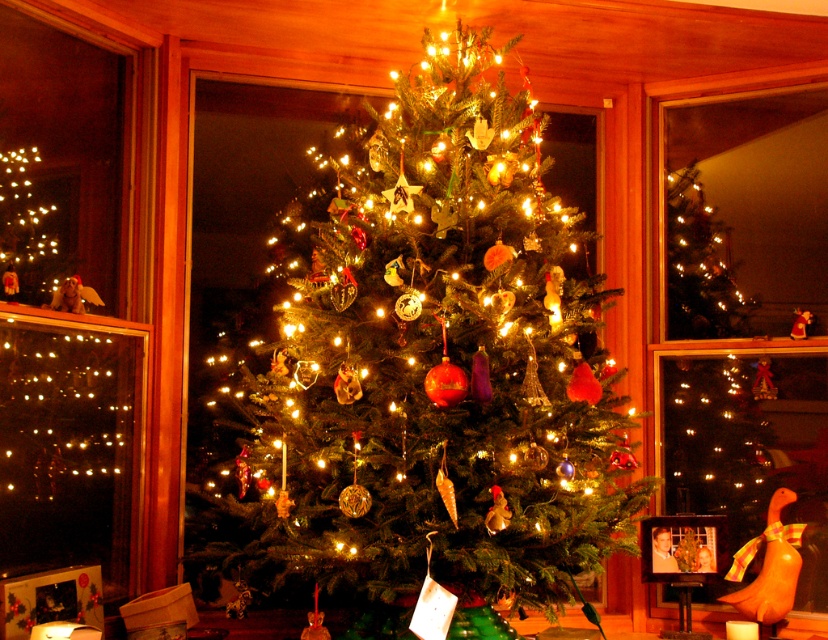
You are standing in the living room and want to take a photo of the green matte christmas tree at center through the clear glass window at upper left. Is the tree positioned in a way that allows you to capture it in the frame?

The green matte christmas tree at center is to the right of the clear glass window at upper left, so you can position yourself to take a photo of the green matte christmas tree at center through the clear glass window at upper left as it is located to the right side of the window.

You are standing in front of the Christmas tree and want to see the view outside through the clear glass window at upper left. Based on its position, where should you look to see the outside view?

The clear glass window at upper left is located at point (66, 308), so you should look towards the upper left area of the room to see the outside view through the clear glass window at upper left.